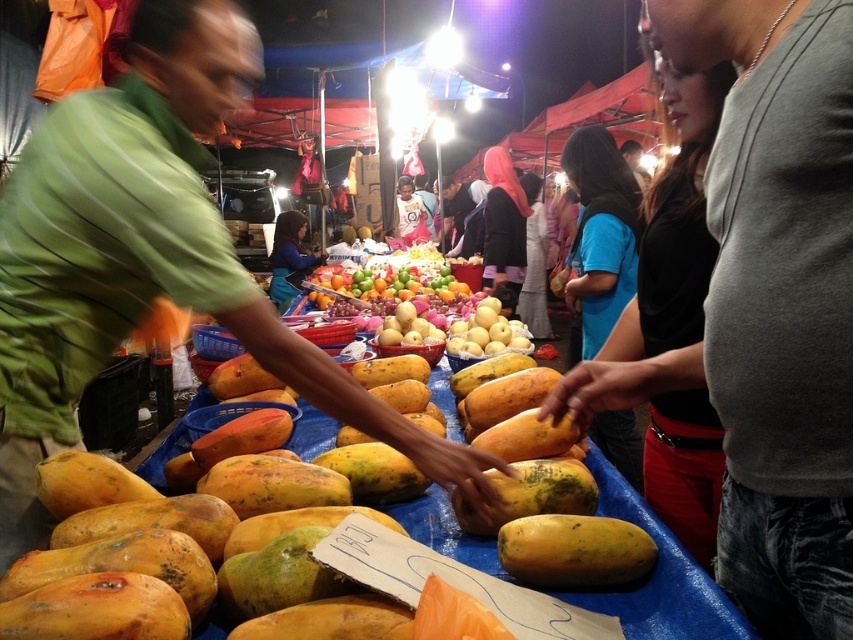
How much distance is there between yellow smooth mangoes at center and blue fabric apron at center?

A distance of 3.27 meters exists between yellow smooth mangoes at center and blue fabric apron at center.

Which is behind, point (496, 314) or point (273, 244)?

Positioned behind is point (273, 244).

You are a GUI agent. You are given a task and a screenshot of the screen. Output one action in this format:
    pyautogui.click(x=<x>, y=<y>)
    Task: Click on the yellow smooth mangoes at center
    
    Given the screenshot: What is the action you would take?
    pyautogui.click(x=486, y=333)

Between yellow smooth mangoes at center and white cotton shirt at center, which one appears on the right side from the viewer's perspective?

yellow smooth mangoes at center is more to the right.

I want to click on yellow smooth mangoes at center, so click(486, 333).

From the picture: Is gray cotton shirt at center bigger than blue fabric apron at center?

No, gray cotton shirt at center is not bigger than blue fabric apron at center.

Consider the image. Can you confirm if gray cotton shirt at center is positioned to the right of blue fabric apron at center?

Correct, you'll find gray cotton shirt at center to the right of blue fabric apron at center.

Who is more forward, (834, 241) or (288, 289)?

Positioned in front is point (834, 241).

This screenshot has width=853, height=640. Identify the location of gray cotton shirt at center. (779, 300).